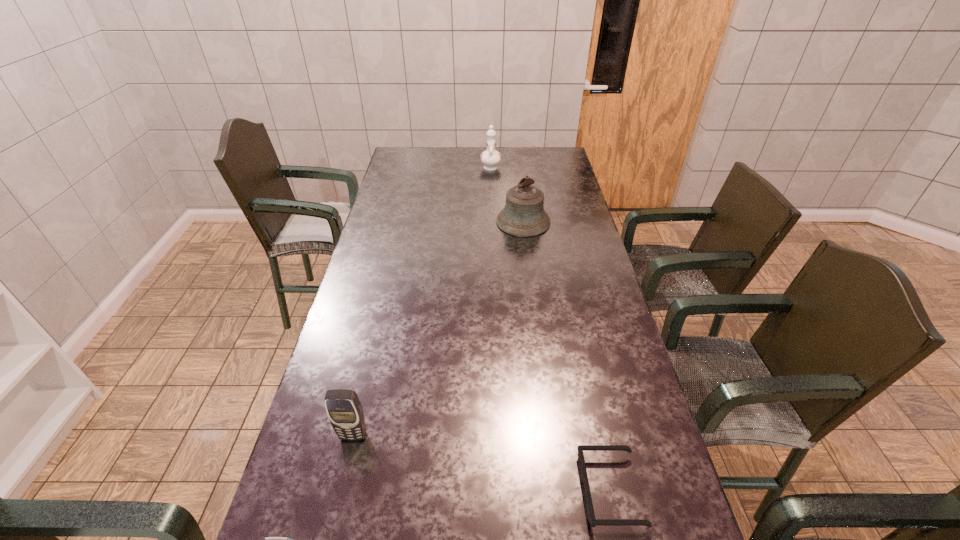
I want to click on vacant area situated 0.120m on the front-facing side of the sunglasses, so click(527, 490).

Where is `object located at the far edge`? Image resolution: width=960 pixels, height=540 pixels. object located at the far edge is located at coordinates (490, 158).

You are a GUI agent. You are given a task and a screenshot of the screen. Output one action in this format:
    pyautogui.click(x=<x>, y=<y>)
    Task: Click on the object that is at the left edge
    This screenshot has height=540, width=960.
    Given the screenshot: What is the action you would take?
    pyautogui.click(x=344, y=409)

Find the location of a particular element. Image resolution: width=960 pixels, height=540 pixels. bell located at the right edge is located at coordinates (523, 215).

What are the coordinates of `sunglasses situated at the right edge` in the screenshot? It's located at (590, 514).

The width and height of the screenshot is (960, 540). Find the location of `vacant space at the far edge`. vacant space at the far edge is located at coordinates (521, 162).

In the image, there is a desktop. Where is `vacant region at the left edge`? This screenshot has height=540, width=960. vacant region at the left edge is located at coordinates (414, 170).

Locate an element on the screen. Image resolution: width=960 pixels, height=540 pixels. vacant space at the right edge of the desktop is located at coordinates (572, 214).

Find the location of a particular element. vacant space at the far right corner is located at coordinates (553, 154).

Locate an element on the screen. The height and width of the screenshot is (540, 960). free spot between the farther cellular telephone and the second farthest object is located at coordinates (439, 328).